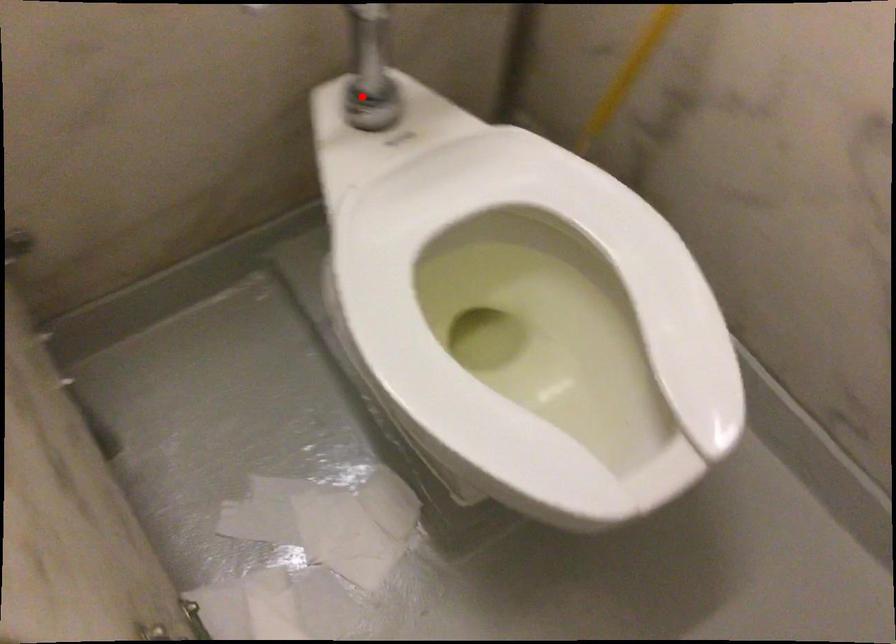
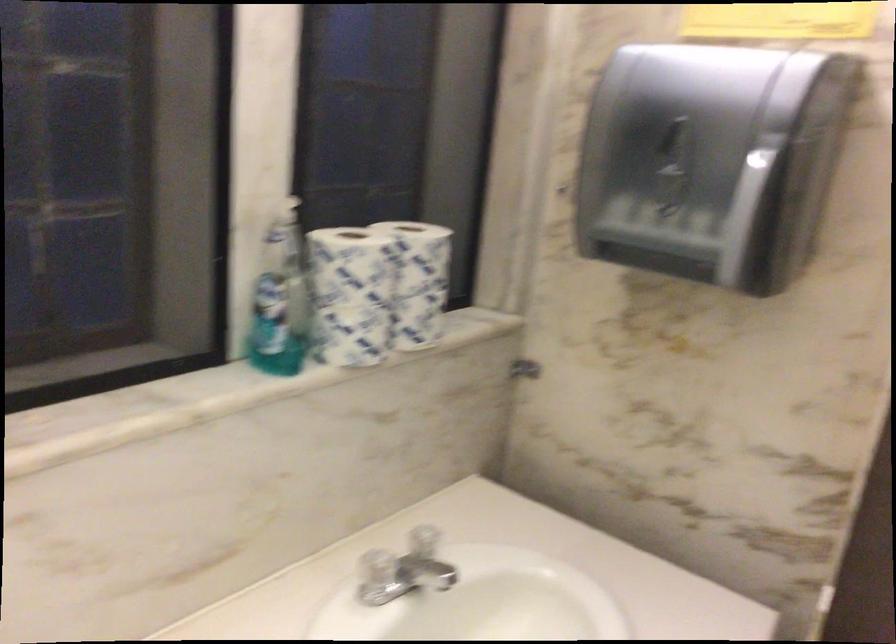
Question: I am providing you with two images of the same scene from different viewpoints. A red point is marked on the first image. At the location where the point appears in image 1, is it still visible in image 2?

Choices:
 (A) Yes
 (B) No

Answer: (B)